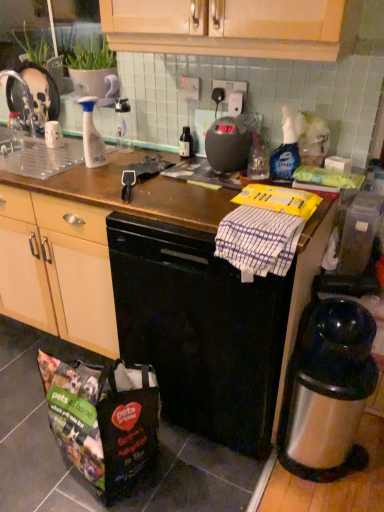
Question: Can you confirm if white striped towel at center is wider than polyester shopping bag at lower left?

Choices:
 (A) no
 (B) yes

Answer: (A)

Question: From the image's perspective, does white striped towel at center appear higher than polyester shopping bag at lower left?

Choices:
 (A) no
 (B) yes

Answer: (B)

Question: Is white striped towel at center taller than polyester shopping bag at lower left?

Choices:
 (A) yes
 (B) no

Answer: (B)

Question: Is white striped towel at center to the right of polyester shopping bag at lower left from the viewer's perspective?

Choices:
 (A) no
 (B) yes

Answer: (B)

Question: From a real-world perspective, does white striped towel at center sit lower than polyester shopping bag at lower left?

Choices:
 (A) no
 (B) yes

Answer: (A)

Question: Is white striped towel at center facing away from polyester shopping bag at lower left?

Choices:
 (A) no
 (B) yes

Answer: (A)

Question: Would you say transparent plastic container at right is a long distance from clear plastic bottle at center, the 2th bottle in the left-to-right sequence?

Choices:
 (A) yes
 (B) no

Answer: (A)

Question: Is transparent plastic container at right oriented away from clear plastic bottle at center, the 2th bottle in the left-to-right sequence?

Choices:
 (A) yes
 (B) no

Answer: (B)

Question: From the image's perspective, does transparent plastic container at right appear higher than clear plastic bottle at center, the 2th bottle in the left-to-right sequence?

Choices:
 (A) yes
 (B) no

Answer: (B)

Question: Is clear plastic bottle at center, the 2th bottle in the left-to-right sequence, located within transparent plastic container at right?

Choices:
 (A) yes
 (B) no

Answer: (B)

Question: Considering the relative sizes of transparent plastic container at right and clear plastic bottle at center, the 3th bottle viewed from the right, in the image provided, is transparent plastic container at right bigger than clear plastic bottle at center, the 3th bottle viewed from the right,?

Choices:
 (A) yes
 (B) no

Answer: (A)

Question: Is transparent plastic container at right thinner than clear plastic bottle at center, the 3th bottle viewed from the right?

Choices:
 (A) yes
 (B) no

Answer: (B)

Question: Does brown wooden counter top at center have a lesser height compared to white striped towel at center?

Choices:
 (A) no
 (B) yes

Answer: (A)